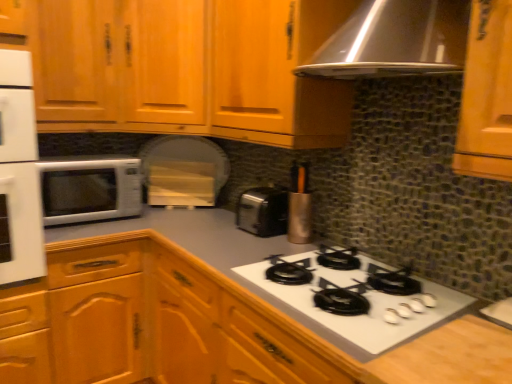
The image size is (512, 384). Find the location of `vacant area that is in front of metallic silver utensil holder at upper center`. vacant area that is in front of metallic silver utensil holder at upper center is located at coordinates (291, 248).